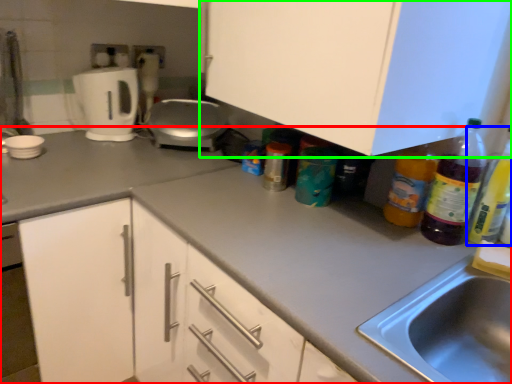
Question: Which object is the closest to the countertop (highlighted by a red box)? Choose among these: bottle (highlighted by a blue box) or cabinetry (highlighted by a green box).

Choices:
 (A) bottle
 (B) cabinetry

Answer: (B)